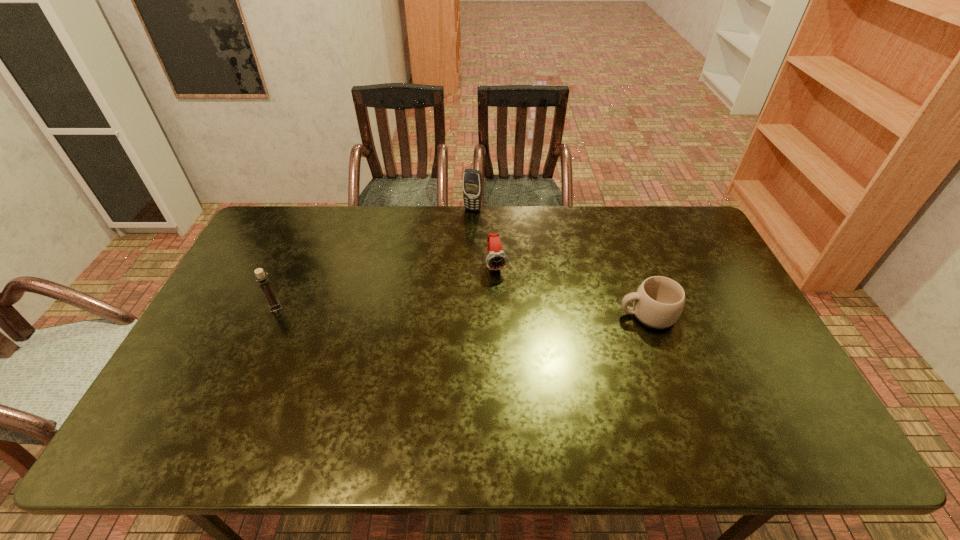
Locate an element on the screen. Image resolution: width=960 pixels, height=540 pixels. vacant space located 0.060m on the face of the second farthest object is located at coordinates (502, 290).

Locate an element on the screen. vacant area located 0.070m on the face of the second farthest object is located at coordinates (503, 293).

You are a GUI agent. You are given a task and a screenshot of the screen. Output one action in this format:
    pyautogui.click(x=<x>, y=<y>)
    Task: Click on the vacant space located 0.160m on the face of the second farthest object
    
    Given the screenshot: What is the action you would take?
    pyautogui.click(x=508, y=315)

The height and width of the screenshot is (540, 960). Find the location of `vacant space situated 0.100m on the front face of the farthest object`. vacant space situated 0.100m on the front face of the farthest object is located at coordinates (463, 228).

Locate an element on the screen. free location located on the front face of the farthest object is located at coordinates (462, 230).

The height and width of the screenshot is (540, 960). In order to click on vacant space located 0.230m on the front face of the farthest object in this screenshot , I will do `click(451, 252)`.

You are a GUI agent. You are given a task and a screenshot of the screen. Output one action in this format:
    pyautogui.click(x=<x>, y=<y>)
    Task: Click on the object that is at the far edge
    This screenshot has height=540, width=960.
    Given the screenshot: What is the action you would take?
    pyautogui.click(x=472, y=179)

Where is `object at the left edge`? The image size is (960, 540). object at the left edge is located at coordinates (x=274, y=305).

In the image, there is a desktop. At what (x,y) coordinates should I click in order to perform the action: click on vacant space at the far edge. Please return your answer as a coordinate pair (x, y). Looking at the image, I should click on (629, 229).

Identify the location of blank space at the near edge of the desktop. Image resolution: width=960 pixels, height=540 pixels. (462, 407).